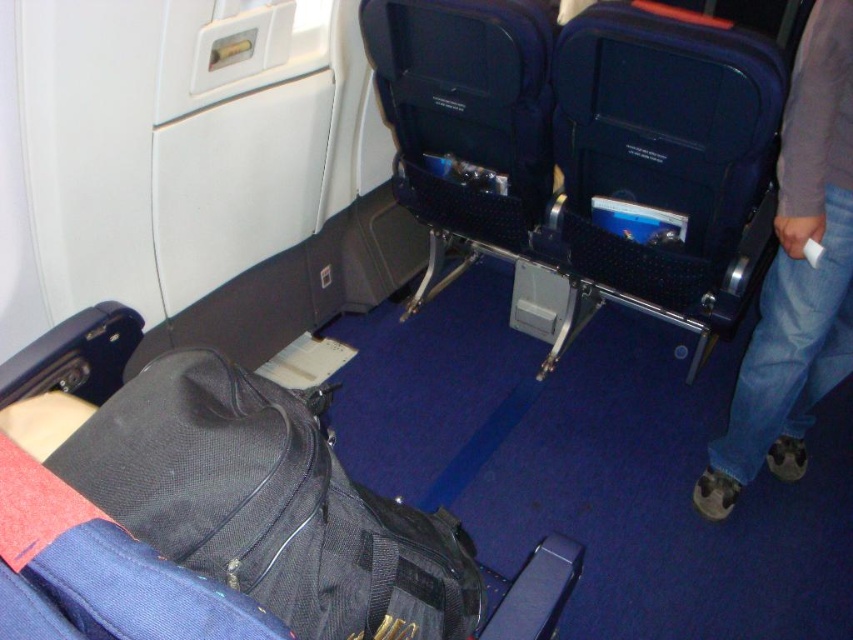
Question: Does black mesh backpack at lower left have a greater width compared to jeans at right?

Choices:
 (A) yes
 (B) no

Answer: (A)

Question: Which point is closer to the camera taking this photo?

Choices:
 (A) (776, 433)
 (B) (119, 509)

Answer: (B)

Question: Is the position of black mesh backpack at lower left less distant than that of jeans at right?

Choices:
 (A) no
 (B) yes

Answer: (B)

Question: Is the position of black mesh backpack at lower left more distant than that of jeans at right?

Choices:
 (A) no
 (B) yes

Answer: (A)